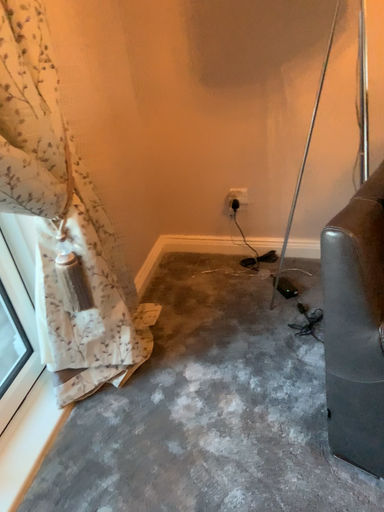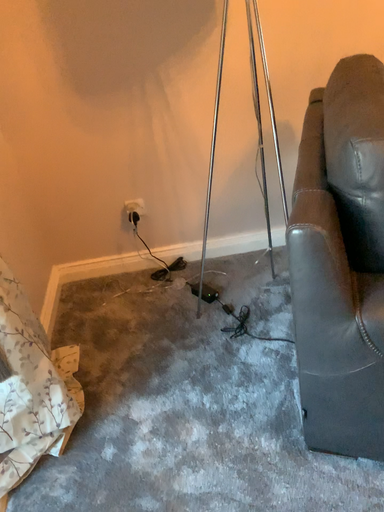
Question: Which way did the camera rotate in the video?

Choices:
 (A) rotated left
 (B) rotated right

Answer: (B)